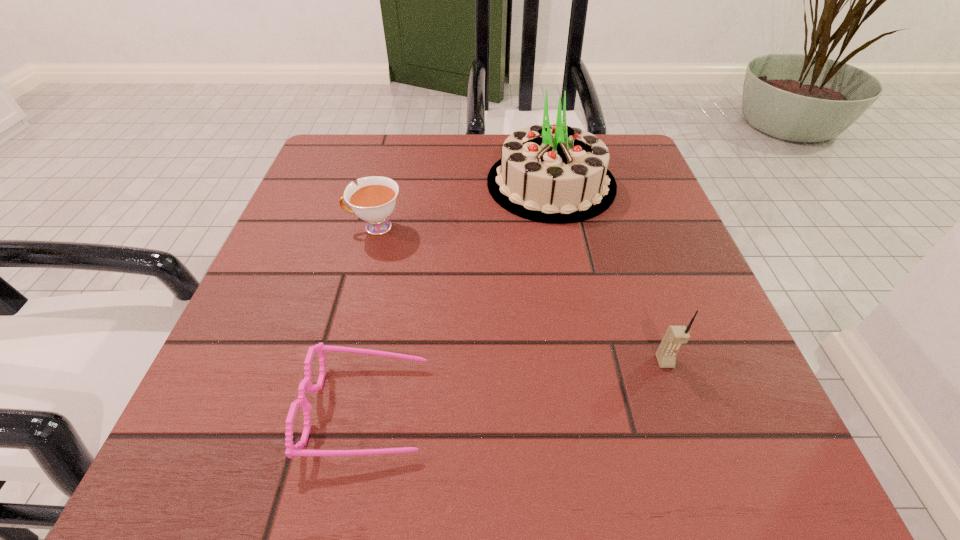
Image resolution: width=960 pixels, height=540 pixels. In order to click on the tallest object in this screenshot , I will do `click(552, 173)`.

I want to click on cellular telephone, so click(x=675, y=336).

Locate an element on the screen. Image resolution: width=960 pixels, height=540 pixels. teacup is located at coordinates (373, 200).

This screenshot has height=540, width=960. Identify the location of the shortest object. (292, 450).

This screenshot has height=540, width=960. I want to click on vacant region located 0.160m on the front of the tallest object, so click(570, 283).

You are a GUI agent. You are given a task and a screenshot of the screen. Output one action in this format:
    pyautogui.click(x=<x>, y=<y>)
    Task: Click on the blank space located on the front of the second tallest object, where the keypad is located
    This screenshot has height=540, width=960.
    Given the screenshot: What is the action you would take?
    pyautogui.click(x=684, y=421)

At what (x,y) coordinates should I click in order to perform the action: click on free location located 0.080m on the side of the second shortest object with the handle. Please return your answer as a coordinate pair (x, y). Looking at the image, I should click on (305, 227).

Where is `vacant space located on the arms of the shortest object`? vacant space located on the arms of the shortest object is located at coordinates (542, 408).

Image resolution: width=960 pixels, height=540 pixels. I want to click on object that is at the far edge, so click(552, 173).

Locate an element on the screen. The width and height of the screenshot is (960, 540). object at the near edge is located at coordinates (292, 450).